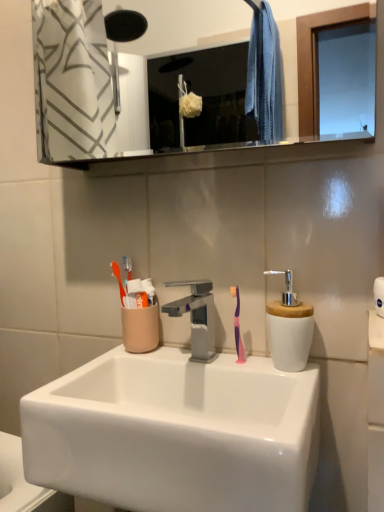
You are a GUI agent. You are given a task and a screenshot of the screen. Output one action in this format:
    pyautogui.click(x=<x>, y=<y>)
    Task: Click on the vacant area that is in front of pink rubber toothbrush at center
    The height and width of the screenshot is (512, 384).
    Given the screenshot: What is the action you would take?
    pyautogui.click(x=261, y=378)